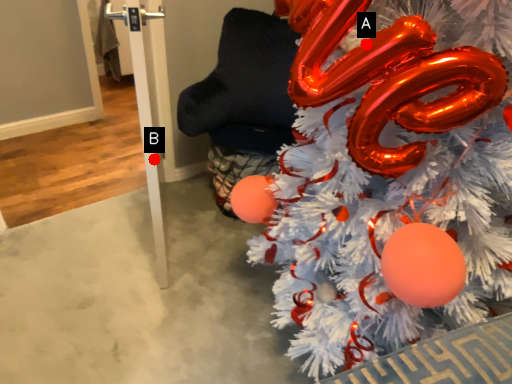
Question: Two points are circled on the image, labeled by A and B beside each circle. Which point is further to the camera?

Choices:
 (A) A is further
 (B) B is further

Answer: (B)